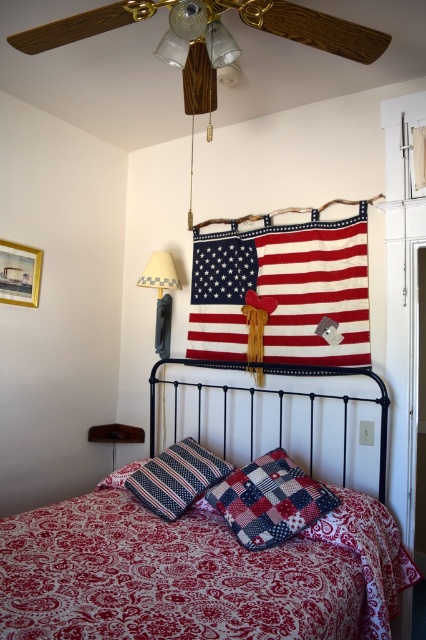
You are an interior designer planning to hang a large painting in this bedroom corner. The painting is 1.2 meters wide. You need to ensure it doesn not block any objects. Which object between the wooden ceiling fan at upper center and the patterned fabric pillow at center should you avoid placing the painting in front of, and why?

You should avoid placing the painting in front of the wooden ceiling fan at upper center because it occupies less space than the patterned fabric pillow at center, so covering it might be easier with the painting.

You are standing in the bedroom corner and want to place a small decoration on the striped fabric pillow at center. To ensure accuracy, can you determine the exact 2D coordinates where the pillow is located?

The striped fabric pillow at center is located at the 2D coordinates point (176,477).

You are standing in the bedroom corner and notice the wooden ceiling fan at upper center and the patterned fabric pillow at center. From your perspective, which object is positioned to the right?

The wooden ceiling fan at upper center is positioned to the right of the patterned fabric pillow at center.